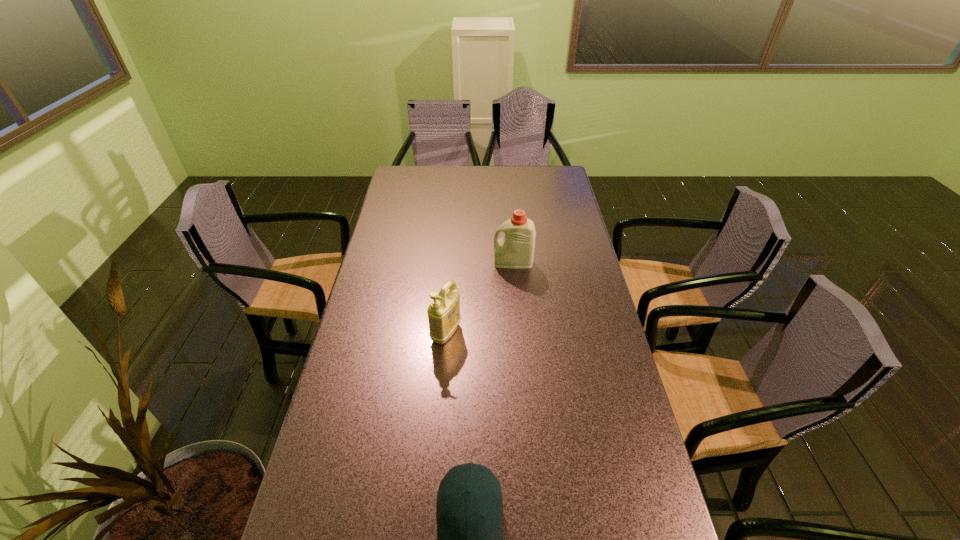
Find the location of `the farther detergent`. the farther detergent is located at coordinates (515, 249).

Locate an element on the screen. Image resolution: width=960 pixels, height=540 pixels. the right detergent is located at coordinates (515, 249).

Identify the location of the second nearest object. The image size is (960, 540). (443, 312).

Find the location of a particular element. This screenshot has height=540, width=960. the left detergent is located at coordinates (443, 312).

The width and height of the screenshot is (960, 540). In order to click on vacant point located on the handle side of the farther detergent in this screenshot , I will do `click(422, 262)`.

Identify the location of free region located on the handle side of the farther detergent. (418, 262).

At what (x,y) coordinates should I click in order to perform the action: click on free spot located 0.390m on the handle side of the farther detergent. Please return your answer as a coordinate pair (x, y). Looking at the image, I should click on (387, 262).

The height and width of the screenshot is (540, 960). Identify the location of free region located 0.190m on the left of the left detergent. (370, 333).

Where is `free location at the far edge`? Image resolution: width=960 pixels, height=540 pixels. free location at the far edge is located at coordinates 468,185.

At what (x,y) coordinates should I click in order to perform the action: click on free point at the left edge. Please return your answer as a coordinate pair (x, y). The width and height of the screenshot is (960, 540). Looking at the image, I should click on (358, 310).